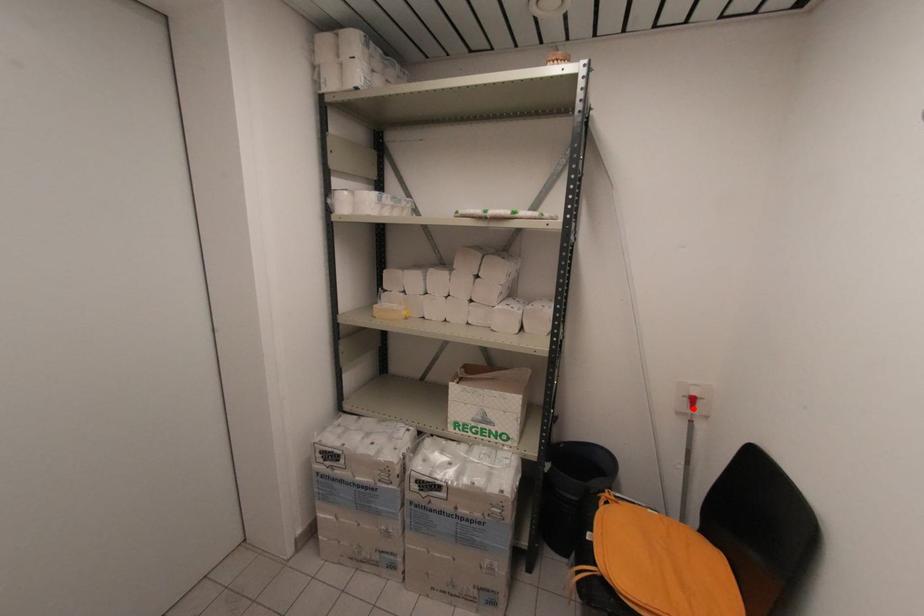
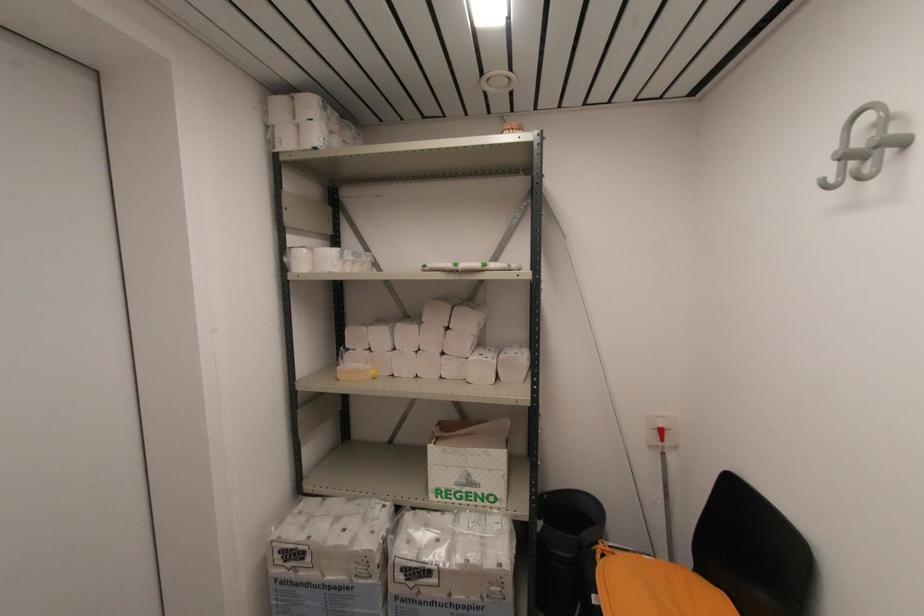
Find the pixel in the second image that matches the highlighted location in the first image.

(663, 439)